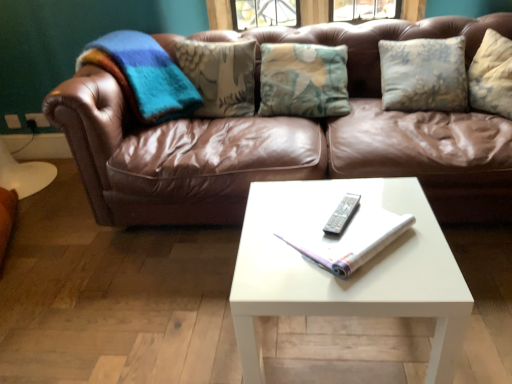
What do you see at coordinates (352, 275) in the screenshot? The height and width of the screenshot is (384, 512). I see `white glossy coffee table at center` at bounding box center [352, 275].

This screenshot has height=384, width=512. I want to click on brown leather couch at center, so click(x=287, y=140).

I want to click on white glossy coffee table at center, so click(352, 275).

Which is behind, white glossy coffee table at center or silver metallic remote at center?

silver metallic remote at center is further from the camera.

Based on their sizes in the image, would you say white glossy coffee table at center is bigger or smaller than silver metallic remote at center?

In the image, white glossy coffee table at center appears to be larger than silver metallic remote at center.

Is the surface of white glossy coffee table at center in direct contact with silver metallic remote at center?

No, white glossy coffee table at center is not touching silver metallic remote at center.

Locate an element on the screen. The image size is (512, 384). remote on the right of white glossy coffee table at center is located at coordinates (342, 215).

Does white glossy coffee table at center have a lesser height compared to white paper book at center?

No.

Looking at this image, considering the relative sizes of white glossy coffee table at center and white paper book at center in the image provided, is white glossy coffee table at center smaller than white paper book at center?

Incorrect, white glossy coffee table at center is not smaller in size than white paper book at center.

Can you tell me how much white glossy coffee table at center and white paper book at center differ in facing direction?

There is a 46.6-degree angle between the facing directions of white glossy coffee table at center and white paper book at center.

Which point is more forward, (332,273) or (433,303)?

The point (433,303) is in front.

Locate an element on the screen. This screenshot has width=512, height=384. coffee table in front of the white paper book at center is located at coordinates (352, 275).

Does white paper book at center have a smaller size compared to white glossy coffee table at center?

Correct, white paper book at center occupies less space than white glossy coffee table at center.

Looking at their sizes, would you say white paper book at center is wider or thinner than white glossy coffee table at center?

white paper book at center is thinner than white glossy coffee table at center.

Is white glossy coffee table at center wider than brown leather couch at center?

In fact, white glossy coffee table at center might be narrower than brown leather couch at center.

From a real-world perspective, does white glossy coffee table at center sit lower than brown leather couch at center?

Indeed, from a real-world perspective, white glossy coffee table at center is positioned beneath brown leather couch at center.

Who is taller, white glossy coffee table at center or brown leather couch at center?

brown leather couch at center.

Considering the sizes of brown leather couch at center and silver metallic remote at center in the image, is brown leather couch at center bigger or smaller than silver metallic remote at center?

brown leather couch at center is bigger than silver metallic remote at center.

In the scene shown: From the image's perspective, is brown leather couch at center located above or below silver metallic remote at center?

Based on their image positions, brown leather couch at center is located above silver metallic remote at center.

Does brown leather couch at center have a lesser width compared to silver metallic remote at center?

Incorrect, the width of brown leather couch at center is not less than that of silver metallic remote at center.

In the scene shown: Is silver metallic remote at center oriented away from white paper book at center?

Absolutely, silver metallic remote at center is directed away from white paper book at center.

Are silver metallic remote at center and white paper book at center making contact?

Yes, silver metallic remote at center and white paper book at center clearly make contact.

How different are the orientations of silver metallic remote at center and white paper book at center in degrees?

The facing directions of silver metallic remote at center and white paper book at center are 20.6 degrees apart.

Is silver metallic remote at center positioned in front of white paper book at center?

No, silver metallic remote at center is further to the viewer.

Looking at the image, does white paper book at center seem bigger or smaller compared to brown leather couch at center?

In the image, white paper book at center appears to be smaller than brown leather couch at center.

Does white paper book at center turn towards brown leather couch at center?

Yes, white paper book at center is turned towards brown leather couch at center.

You are a GUI agent. You are given a task and a screenshot of the screen. Output one action in this format:
    pyautogui.click(x=<x>, y=<y>)
    Task: Click on the studio couch behind the white paper book at center
    The height and width of the screenshot is (384, 512).
    Given the screenshot: What is the action you would take?
    pyautogui.click(x=287, y=140)

Identify the location of coffee table located on the left of silver metallic remote at center. The width and height of the screenshot is (512, 384). (352, 275).

Where is `book above the white glossy coffee table at center (from the image's perspective)`? book above the white glossy coffee table at center (from the image's perspective) is located at coordinates (345, 239).

Considering their positions, is brown leather couch at center positioned further to silver metallic remote at center than white paper book at center?

brown leather couch at center is positioned further to the anchor silver metallic remote at center.

Based on their spatial positions, is white paper book at center or silver metallic remote at center closer to brown leather couch at center?

white paper book at center is closer to brown leather couch at center.

From the image, which object appears to be farther from white paper book at center, brown leather couch at center or silver metallic remote at center?

brown leather couch at center is positioned further to the anchor white paper book at center.

Which object lies further to the anchor point silver metallic remote at center, white paper book at center or white glossy coffee table at center?

Based on the image, white glossy coffee table at center appears to be further to silver metallic remote at center.

Which object lies further to the anchor point white glossy coffee table at center, brown leather couch at center or silver metallic remote at center?

Based on the image, brown leather couch at center appears to be further to white glossy coffee table at center.

Estimate the real-world distances between objects in this image. Which object is further from brown leather couch at center, silver metallic remote at center or white glossy coffee table at center?

silver metallic remote at center is positioned further to the anchor brown leather couch at center.

Considering their positions, is silver metallic remote at center positioned closer to white paper book at center than white glossy coffee table at center?

Based on the image, silver metallic remote at center appears to be nearer to white paper book at center.

Estimate the real-world distances between objects in this image. Which object is further from white glossy coffee table at center, brown leather couch at center or white paper book at center?

brown leather couch at center is further to white glossy coffee table at center.

Identify the location of remote between brown leather couch at center and white glossy coffee table at center in the vertical direction. (342, 215).

Locate an element on the screen. This screenshot has height=384, width=512. book between silver metallic remote at center and white glossy coffee table at center from top to bottom is located at coordinates (345, 239).

Identify the location of remote that lies between brown leather couch at center and white paper book at center from top to bottom. (342, 215).

Identify the location of book between brown leather couch at center and white glossy coffee table at center from top to bottom. The height and width of the screenshot is (384, 512). (345, 239).